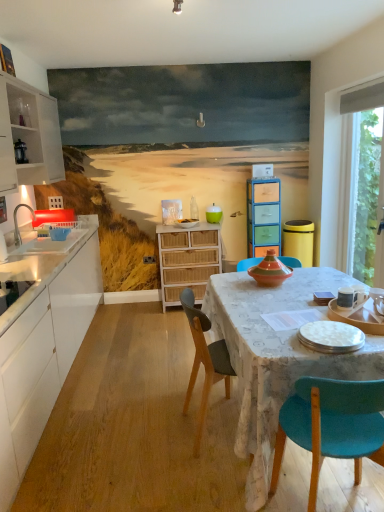
This screenshot has width=384, height=512. What do you see at coordinates (365, 193) in the screenshot?
I see `transparent glass window at right` at bounding box center [365, 193].

The height and width of the screenshot is (512, 384). Describe the element at coordinates (187, 223) in the screenshot. I see `matte wooden tray at center, placed as the 1th tableware when sorted from top to bottom` at that location.

What is the approximate height of matte white sink at left?

matte white sink at left is 20.52 inches in height.

The width and height of the screenshot is (384, 512). What do you see at coordinates (43, 352) in the screenshot? I see `white matte cabinet at left, positioned as the second cabinetry in right-to-left order` at bounding box center [43, 352].

Describe the element at coordinates (204, 361) in the screenshot. The image size is (384, 512). I see `wooden chair at center, which ranks as the second chair in right-to-left order` at that location.

Find the location of `transparent glass window at right`. transparent glass window at right is located at coordinates (365, 193).

Is white matte cabinet at left, positioned as the second cabinetry in right-to-left order, not close to white ceramic mug at upper right, marked as the 2th tableware in a front-to-back arrangement?

Yes, white matte cabinet at left, positioned as the second cabinetry in right-to-left order, and white ceramic mug at upper right, marked as the 2th tableware in a front-to-back arrangement, are located far from each other.

Is white matte cabinet at left, positioned as the second cabinetry in left-to-right order, taller than white ceramic mug at upper right, which is the 1th tableware from right to left?

Correct, white matte cabinet at left, positioned as the second cabinetry in left-to-right order, is much taller as white ceramic mug at upper right, which is the 1th tableware from right to left.

Would you say white matte cabinet at left, positioned as the second cabinetry in left-to-right order, is to the left or to the right of white ceramic mug at upper right, which is the 1th tableware from right to left, in the picture?

In the image, white matte cabinet at left, positioned as the second cabinetry in left-to-right order, appears on the left side of white ceramic mug at upper right, which is the 1th tableware from right to left.

Based on the photo, which object is further away from the camera taking this photo, white matte cabinet at left, positioned as the second cabinetry in right-to-left order, or white ceramic mug at upper right, which ranks as the second tableware in bottom-to-top order?

white ceramic mug at upper right, which ranks as the second tableware in bottom-to-top order, is further from the camera.

How different are the orientations of white ceramic mug at upper right, which ranks as the second tableware in bottom-to-top order, and matte white sink at left in degrees?

180 degrees separate the facing orientations of white ceramic mug at upper right, which ranks as the second tableware in bottom-to-top order, and matte white sink at left.

Is white ceramic mug at upper right, marked as the second tableware in a back-to-front arrangement, spatially inside matte white sink at left, or outside of it?

The correct answer is: outside.

How much distance is there between white ceramic mug at upper right, which appears as the 3th tableware when viewed from the left, and matte white sink at left?

A distance of 2.41 meters exists between white ceramic mug at upper right, which appears as the 3th tableware when viewed from the left, and matte white sink at left.

From their relative heights in the image, would you say white ceramic mug at upper right, which ranks as the second tableware in bottom-to-top order, is taller or shorter than matte white sink at left?

Considering their sizes, white ceramic mug at upper right, which ranks as the second tableware in bottom-to-top order, has less height than matte white sink at left.

From the image's perspective, is transparent glass window at right beneath white wood cabinet at left, the 3th cabinetry viewed from the right?

Yes.

Based on the photo, is white wood cabinet at left, the 3th cabinetry viewed from the right, inside transparent glass window at right?

No.

Consider the image. Which of these two, transparent glass window at right or white wood cabinet at left, the 3th cabinetry viewed from the right, is wider?

Wider between the two is white wood cabinet at left, the 3th cabinetry viewed from the right.

Does transparent glass window at right turn towards white wood cabinet at left, the first cabinetry when ordered from left to right?

Yes, transparent glass window at right faces towards white wood cabinet at left, the first cabinetry when ordered from left to right.

How many degrees apart are the facing directions of white wicker chest of drawers at center and teal fabric chair at lower right, marked as the 1th chair in a right-to-left arrangement?

The facing directions of white wicker chest of drawers at center and teal fabric chair at lower right, marked as the 1th chair in a right-to-left arrangement, are 180 degrees apart.

Does white wicker chest of drawers at center turn towards teal fabric chair at lower right, the 2th chair viewed from the back?

Yes, white wicker chest of drawers at center is oriented towards teal fabric chair at lower right, the 2th chair viewed from the back.

Consider the image. Is white wicker chest of drawers at center taller or shorter than teal fabric chair at lower right, the 2th chair viewed from the back?

white wicker chest of drawers at center is taller than teal fabric chair at lower right, the 2th chair viewed from the back.

Is point (195, 222) positioned before point (217, 230)?

No, it is behind (217, 230).

Considering the sizes of matte wooden tray at center, positioned as the 3th tableware in right-to-left order, and white wicker chest of drawers at center in the image, is matte wooden tray at center, positioned as the 3th tableware in right-to-left order, taller or shorter than white wicker chest of drawers at center?

matte wooden tray at center, positioned as the 3th tableware in right-to-left order, is shorter than white wicker chest of drawers at center.

Which is correct: matte wooden tray at center, which is the 1th tableware from left to right, is inside white wicker chest of drawers at center, or outside of it?

matte wooden tray at center, which is the 1th tableware from left to right, cannot be found inside white wicker chest of drawers at center.

From a real-world perspective, is matte wooden tray at center, the first tableware viewed from the back, on top of white wicker chest of drawers at center?

Yes, from a real-world perspective, matte wooden tray at center, the first tableware viewed from the back, is on top of white wicker chest of drawers at center.

How different are the orientations of matte white sink at left and wooden chair at center, which is counted as the first chair, starting from the back, in degrees?

There is a 0.244-degree angle between the facing directions of matte white sink at left and wooden chair at center, which is counted as the first chair, starting from the back.

Does matte white sink at left lie behind wooden chair at center, which is the first chair in left-to-right order?

Yes, matte white sink at left is further from the camera.

Is point (23, 251) positioned before point (187, 303)?

Yes, it is in front of point (187, 303).

Are matte white sink at left and wooden chair at center, which is the first chair in left-to-right order, making contact?

There is a gap between matte white sink at left and wooden chair at center, which is the first chair in left-to-right order.

From a real-world perspective, which cabinetry is the 1st one above the white ceramic mug at upper right, which is the 1th tableware from right to left? Please provide its 2D coordinates.

[(263, 216)]

Is white ceramic mug at upper right, marked as the second tableware in a back-to-front arrangement, wider or thinner than multicolored wood cabinet at center, acting as the third cabinetry starting from the left?

Considering their sizes, white ceramic mug at upper right, marked as the second tableware in a back-to-front arrangement, looks slimmer than multicolored wood cabinet at center, acting as the third cabinetry starting from the left.

Is white ceramic mug at upper right, marked as the 2th tableware in a front-to-back arrangement, to the right of multicolored wood cabinet at center, acting as the third cabinetry starting from the left, from the viewer's perspective?

Indeed, white ceramic mug at upper right, marked as the 2th tableware in a front-to-back arrangement, is positioned on the right side of multicolored wood cabinet at center, acting as the third cabinetry starting from the left.

Find the location of a particular element. the 2nd tableware directly above the white matte cabinet at left, positioned as the second cabinetry in left-to-right order (from a real-world perspective) is located at coordinates (351, 297).

The image size is (384, 512). In order to click on sink on the left of white ceramic mug at upper right, marked as the second tableware in a back-to-front arrangement in this screenshot , I will do `click(44, 228)`.

When comparing their distances from matte wooden tray at center, which is the 1th tableware from left to right, does white glossy plate at lower right, which is the third tableware in top-to-bottom order, or white wicker chest of drawers at center seem further?

white glossy plate at lower right, which is the third tableware in top-to-bottom order, is further to matte wooden tray at center, which is the 1th tableware from left to right.

Considering their positions, is white matte cabinet at left, positioned as the second cabinetry in right-to-left order, positioned further to wooden chair at center, which is the first chair in left-to-right order, than multicolored wood cabinet at center, acting as the third cabinetry starting from the left?

multicolored wood cabinet at center, acting as the third cabinetry starting from the left.

Considering their positions, is matte wooden tray at center, which is counted as the third tableware, starting from the bottom, positioned further to white wood cabinet at left, the 3th cabinetry viewed from the right, than wooden chair at center, the second chair from the front?

wooden chair at center, the second chair from the front, lies further to white wood cabinet at left, the 3th cabinetry viewed from the right, than the other object.

Based on their spatial positions, is teal fabric chair at lower right, which appears as the 2th chair when viewed from the left, or textured fabric tablecloth at center further from white matte cabinet at left, positioned as the second cabinetry in left-to-right order?

teal fabric chair at lower right, which appears as the 2th chair when viewed from the left, is positioned further to the anchor white matte cabinet at left, positioned as the second cabinetry in left-to-right order.

Looking at the image, which one is located closer to matte wooden tray at center, which is counted as the third tableware, starting from the bottom, transparent glass window at right or white wicker chest of drawers at center?

white wicker chest of drawers at center.

From the image, which object appears to be nearer to transparent glass window at right, teal matte cup at center or multicolored wood cabinet at center, acting as the 1th cabinetry starting from the right?

multicolored wood cabinet at center, acting as the 1th cabinetry starting from the right, is closer to transparent glass window at right.

Looking at the image, which one is located further to white wood cabinet at left, the 3th cabinetry viewed from the right, textured fabric tablecloth at center or wooden chair at center, which is the first chair in left-to-right order?

Based on the image, textured fabric tablecloth at center appears to be further to white wood cabinet at left, the 3th cabinetry viewed from the right.

From the image, which object appears to be farther from white wicker chest of drawers at center, white wood cabinet at left, the 3th cabinetry viewed from the right, or matte white sink at left?

The object further to white wicker chest of drawers at center is white wood cabinet at left, the 3th cabinetry viewed from the right.

Locate an element on the screen. This screenshot has height=512, width=384. tableware between wooden chair at center, which ranks as the second chair in right-to-left order, and white ceramic mug at upper right, which ranks as the second tableware in bottom-to-top order, in the horizontal direction is located at coordinates (331, 337).

Find the location of a particular element. The height and width of the screenshot is (512, 384). kitchen & dining room table between white matte cabinet at left, positioned as the second cabinetry in right-to-left order, and white ceramic mug at upper right, placed as the second tableware when sorted from top to bottom, from left to right is located at coordinates (275, 358).

Identify the location of cabinetry between transparent glass window at right and teal matte cup at center from front to back. (263, 216).

At what (x,y) coordinates should I click in order to perform the action: click on tableware positioned between white glossy plate at lower right, acting as the 2th tableware starting from the right, and white wicker chest of drawers at center from near to far. Please return your answer as a coordinate pair (x, y). The height and width of the screenshot is (512, 384). Looking at the image, I should click on (351, 297).